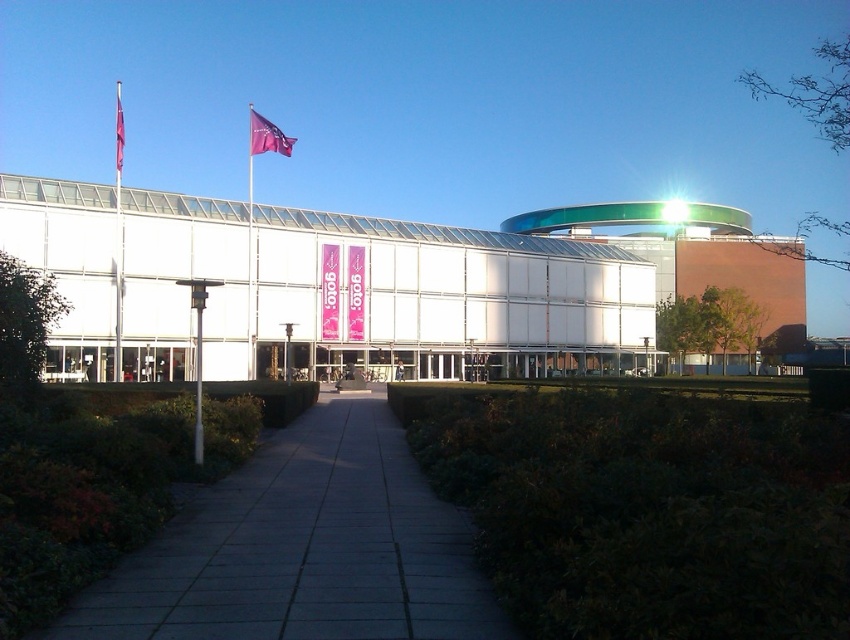
Question: Is the position of gray concrete pavement at center more distant than that of metallic flag pole at left?

Choices:
 (A) no
 (B) yes

Answer: (A)

Question: Which point is closer to the camera?

Choices:
 (A) purple fabric flag at upper left
 (B) metallic flag pole at left

Answer: (A)

Question: Which object is closer to the camera taking this photo?

Choices:
 (A) matte purple flag at upper center
 (B) gray concrete pavement at center

Answer: (B)

Question: Does purple fabric flag at upper left have a larger size compared to matte purple flag at upper center?

Choices:
 (A) no
 (B) yes

Answer: (B)

Question: Is metallic flag pole at left positioned behind purple fabric flag at upper left?

Choices:
 (A) yes
 (B) no

Answer: (A)

Question: Which of the following is the closest to the observer?

Choices:
 (A) gray concrete pavement at center
 (B) metallic flag pole at left

Answer: (A)